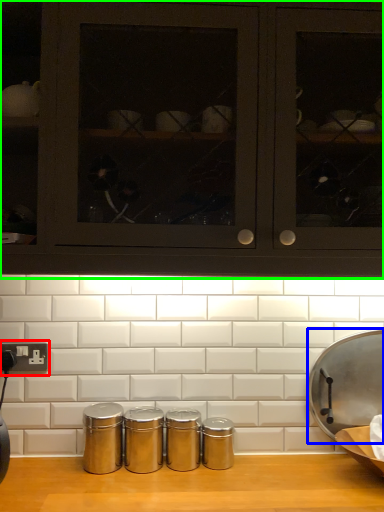
Question: Based on their relative distances, which object is nearer to electric outlet (highlighted by a red box)? Choose from wide (highlighted by a blue box) and cabinetry (highlighted by a green box).

Choices:
 (A) wide
 (B) cabinetry

Answer: (B)